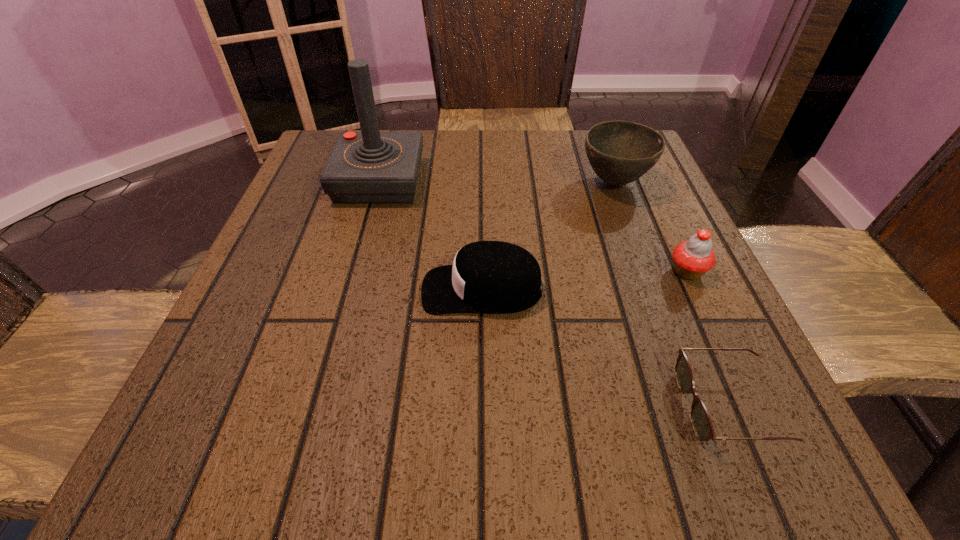
Where is `free spot at the near left corner of the desktop`? Image resolution: width=960 pixels, height=540 pixels. free spot at the near left corner of the desktop is located at coordinates (213, 422).

This screenshot has width=960, height=540. Find the location of `free space at the near right corner of the desktop`. free space at the near right corner of the desktop is located at coordinates (716, 475).

The image size is (960, 540). Find the location of `vacant space that's between the joystick and the cap`. vacant space that's between the joystick and the cap is located at coordinates (x=431, y=235).

Locate an element on the screen. The height and width of the screenshot is (540, 960). free area in between the cap and the cupcake is located at coordinates (585, 280).

Where is `vacant region between the spectacles and the cupcake`? The image size is (960, 540). vacant region between the spectacles and the cupcake is located at coordinates (708, 339).

At what (x,y) coordinates should I click in order to perform the action: click on empty location between the fourth shortest object and the spectacles. Please return your answer as a coordinate pair (x, y). The width and height of the screenshot is (960, 540). Looking at the image, I should click on (671, 294).

This screenshot has width=960, height=540. Find the location of `blank region between the leftmost object and the cap`. blank region between the leftmost object and the cap is located at coordinates (431, 235).

Where is `vacant space in between the spectacles and the bowl`? The image size is (960, 540). vacant space in between the spectacles and the bowl is located at coordinates (671, 294).

The width and height of the screenshot is (960, 540). In order to click on vacant area that lies between the spectacles and the leftmost object in this screenshot , I will do `click(553, 293)`.

You are a GUI agent. You are given a task and a screenshot of the screen. Output one action in this format:
    pyautogui.click(x=<x>, y=<y>)
    Task: Click on the free spot between the leftmost object and the nearest object
    
    Given the screenshot: What is the action you would take?
    pyautogui.click(x=553, y=293)